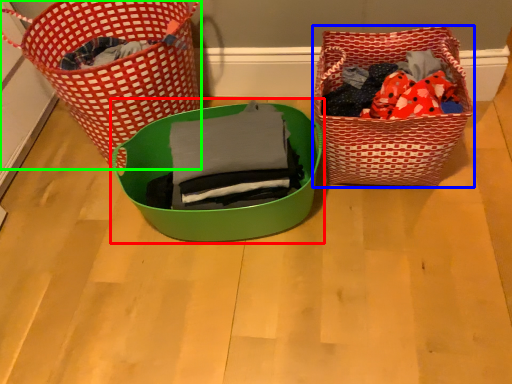
Question: Estimate the real-world distances between objects in this image. Which object is closer to gift basket (highlighted by a red box), picnic basket (highlighted by a blue box) or picnic basket (highlighted by a green box)?

Choices:
 (A) picnic basket
 (B) picnic basket

Answer: (A)